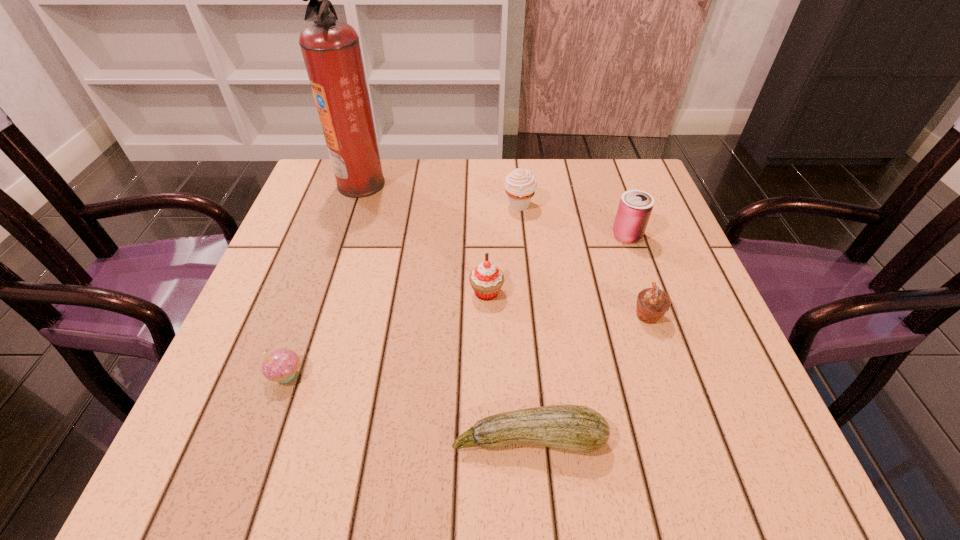
At what (x,y) coordinates should I click in order to perform the action: click on free space between the farther cupcake and the left muffin. Please return your answer as a coordinate pair (x, y). This screenshot has height=540, width=960. Looking at the image, I should click on (503, 249).

Find the location of a particular element. This screenshot has height=540, width=960. object that is the closest to the zucchini is located at coordinates (652, 303).

This screenshot has width=960, height=540. Find the location of `the third closest object to the shorter muffin`. the third closest object to the shorter muffin is located at coordinates click(x=486, y=279).

Image resolution: width=960 pixels, height=540 pixels. I want to click on free spot that satisfies the following two spatial constraints: 1. at the nozzle of the fire extinguisher; 2. on the back side of the fifth nearest object, so click(345, 235).

You are a GUI agent. You are given a task and a screenshot of the screen. Output one action in this format:
    pyautogui.click(x=<x>, y=<y>)
    Task: Click on the blank space that satisfies the following two spatial constraints: 1. at the nozzle of the fire extinguisher; 2. on the front side of the nearer cupcake
    This screenshot has height=540, width=960.
    Given the screenshot: What is the action you would take?
    pyautogui.click(x=300, y=375)